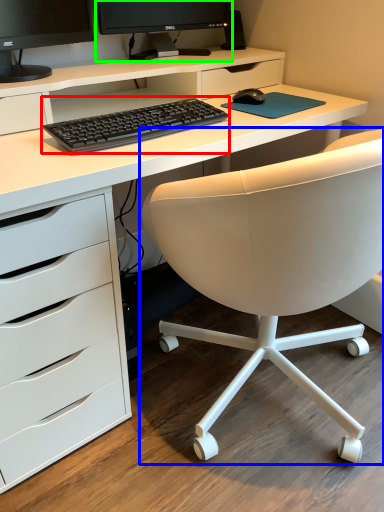
Question: Estimate the real-world distances between objects in this image. Which object is closer to computer keyboard (highlighted by a red box), chair (highlighted by a blue box) or computer monitor (highlighted by a green box)?

Choices:
 (A) chair
 (B) computer monitor

Answer: (A)